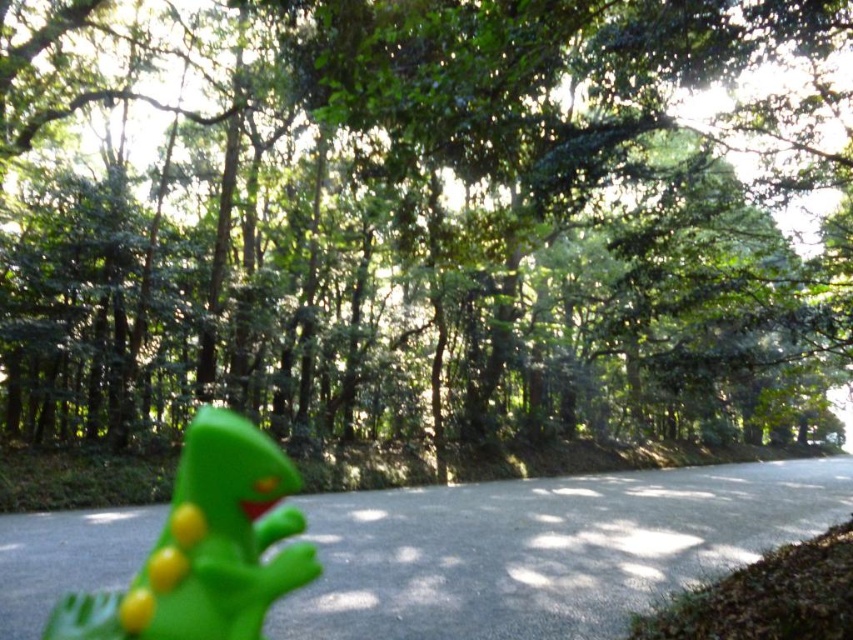
You are a hiker carrying a backpack that is 20 inches wide. You come across the green matte tree at center and the green rubber toy at lower left. Which object can your backpack fit through if you need to pass between them?

The green rubber toy at lower left can fit through since the green matte tree at center might be wider than the green rubber toy at lower left, so the space between them may be narrower than 20 inches.

You are a hiker walking along the paved road in the forest. You see the green matte tree at center and the green rubber toy at lower left. Which object is closer to you as you walk on the road?

The green matte tree at center is closer to you because it is in front of the green rubber toy at lower left, meaning it is positioned nearer to your viewpoint along the road.

You are standing at the point marked as point (424,220) in the forest scene. What object are you standing on?

You are standing on the green matte tree at center.